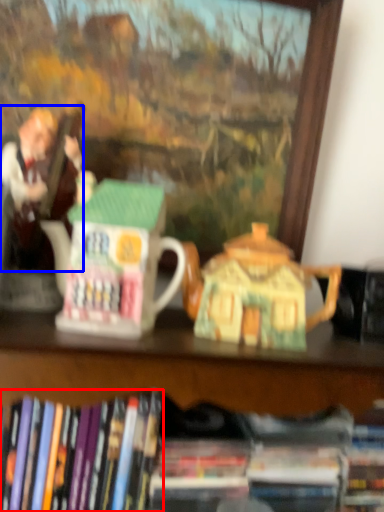
Question: Which point is further to the camera, book (highlighted by a red box) or person (highlighted by a blue box)?

Choices:
 (A) book
 (B) person

Answer: (B)